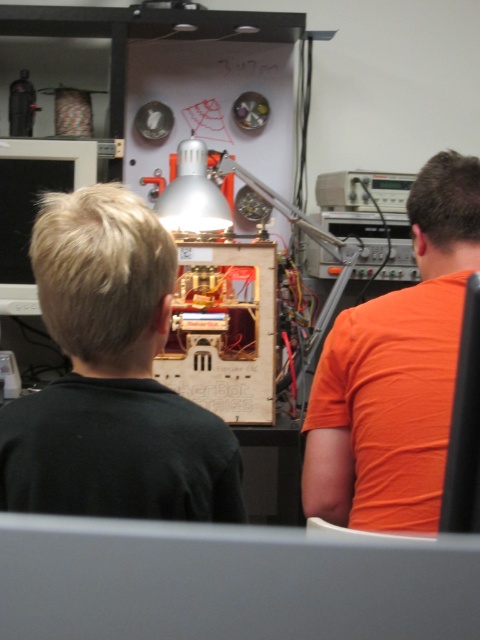
Is point (1, 296) positioned after point (447, 444)?

Yes, point (1, 296) is farther from viewer.

The height and width of the screenshot is (640, 480). I want to click on matte black monitor at left, so click(33, 205).

Is point (70, 160) in front of point (472, 492)?

No, (70, 160) is behind (472, 492).

The image size is (480, 640). Identify the location of matte black monitor at left. (33, 205).

Based on the photo, between black matte boy at center and orange matte computer monitor at upper right, which one has more height?

black matte boy at center

Does black matte boy at center appear over orange matte computer monitor at upper right?

Indeed, black matte boy at center is positioned over orange matte computer monitor at upper right.

This screenshot has height=640, width=480. What do you see at coordinates (111, 378) in the screenshot? I see `black matte boy at center` at bounding box center [111, 378].

Where is `black matte boy at center`? This screenshot has width=480, height=640. black matte boy at center is located at coordinates (111, 378).

Between black matte boy at center and orange cotton shirt at right, which one is positioned lower?

Positioned lower is black matte boy at center.

Does black matte boy at center appear over orange cotton shirt at right?

Incorrect, black matte boy at center is not positioned above orange cotton shirt at right.

Between point (168, 452) and point (414, 221), which one is positioned behind?

Point (414, 221)

Find the location of a particular element. The height and width of the screenshot is (640, 480). black matte boy at center is located at coordinates (111, 378).